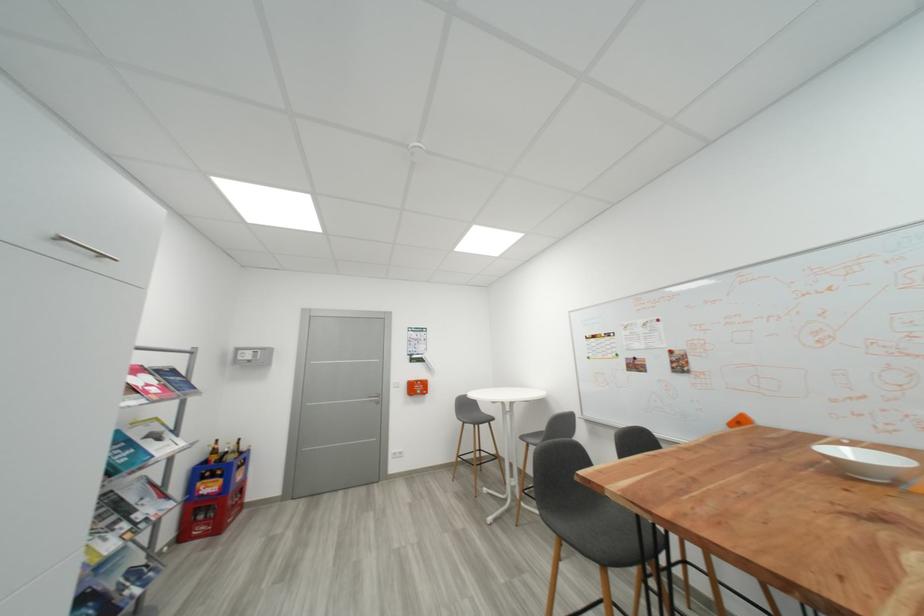
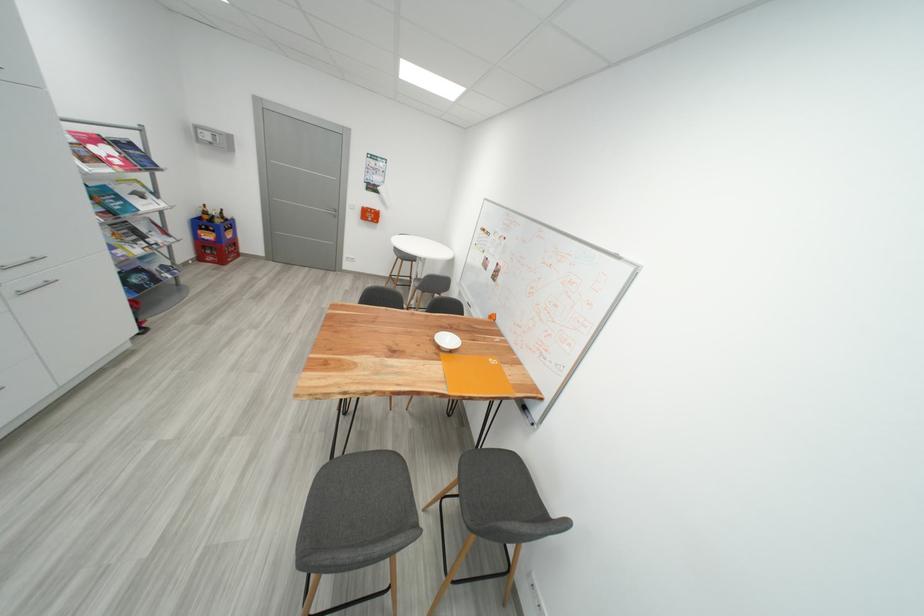
The point at (237, 459) is marked in the first image. Where is the corresponding point in the second image?

(225, 223)